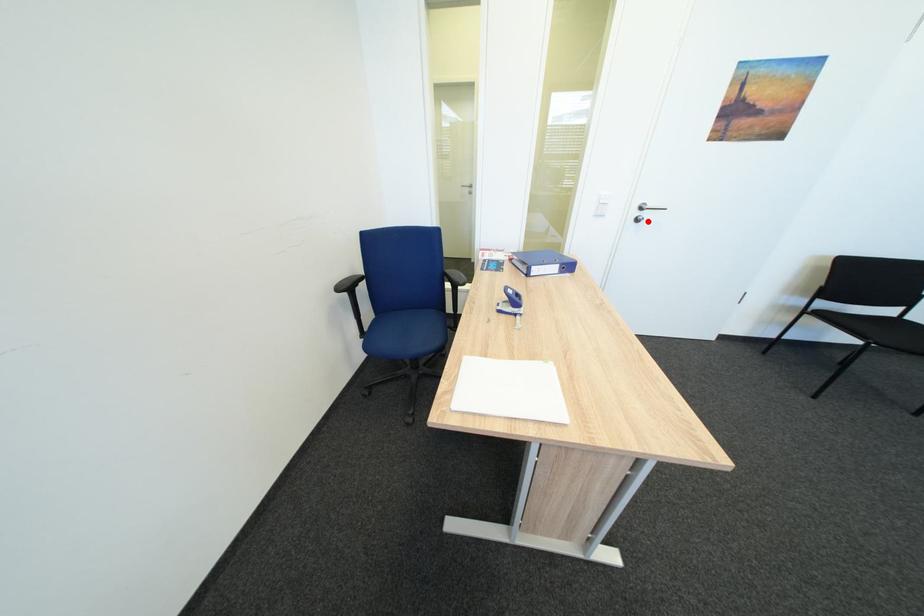
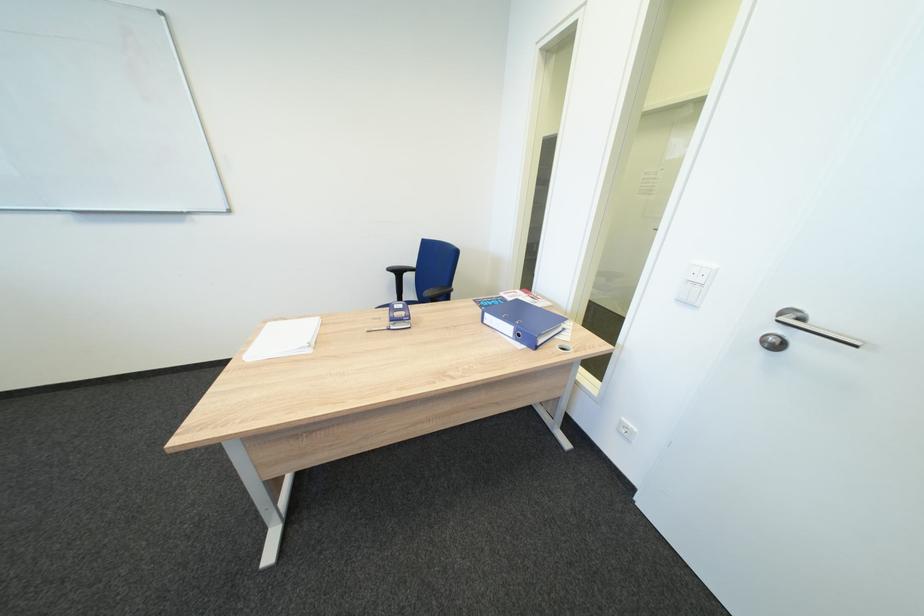
Find the pixel in the second image that matches the highlighted location in the first image.

(784, 346)